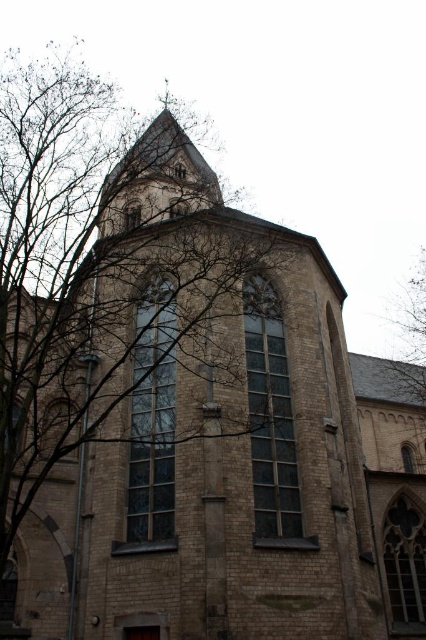
Who is shorter, stained glass window at center or green leafy tree at upper left?

stained glass window at center

Can you confirm if stained glass window at center is positioned above green leafy tree at upper left?

No, stained glass window at center is not above green leafy tree at upper left.

Locate an element on the screen. Image resolution: width=426 pixels, height=640 pixels. stained glass window at center is located at coordinates (270, 413).

Is clear glass window at lower right behind green leafy tree at upper left?

No.

Can you confirm if clear glass window at lower right is taller than green leafy tree at upper left?

No, clear glass window at lower right is not taller than green leafy tree at upper left.

At what (x,y) coordinates should I click in order to perform the action: click on clear glass window at lower right. Please return your answer as a coordinate pair (x, y). Looking at the image, I should click on coord(405,564).

Between clear glass window at center and stained glass window at center, which one is positioned lower?

stained glass window at center

Based on the photo, does clear glass window at center appear on the left side of stained glass window at center?

Indeed, clear glass window at center is positioned on the left side of stained glass window at center.

The height and width of the screenshot is (640, 426). Identify the location of clear glass window at center. (152, 419).